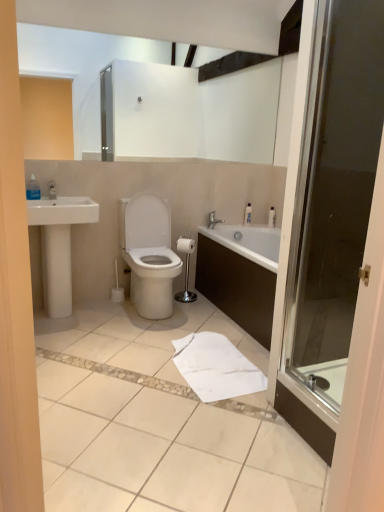
Question: Is transparent plastic bottle at upper left, marked as the 1th toiletry in a left-to-right arrangement, facing away from silver metallic faucet at upper center?

Choices:
 (A) yes
 (B) no

Answer: (B)

Question: From a real-world perspective, does transparent plastic bottle at upper left, marked as the 1th toiletry in a left-to-right arrangement, sit lower than silver metallic faucet at upper center?

Choices:
 (A) yes
 (B) no

Answer: (B)

Question: Does transparent plastic bottle at upper left, the third toiletry viewed from the right, come behind silver metallic faucet at upper center?

Choices:
 (A) no
 (B) yes

Answer: (A)

Question: From the image's perspective, is transparent plastic bottle at upper left, the first toiletry viewed from the front, on silver metallic faucet at upper center?

Choices:
 (A) no
 (B) yes

Answer: (B)

Question: Is transparent plastic bottle at upper left, the first toiletry viewed from the front, to the left of silver metallic faucet at upper center from the viewer's perspective?

Choices:
 (A) yes
 (B) no

Answer: (A)

Question: Is transparent plastic bottle at upper left, which appears as the 3th toiletry when viewed from the back, taller than silver metallic faucet at upper center?

Choices:
 (A) no
 (B) yes

Answer: (B)

Question: Can you confirm if white ceramic sink at left is taller than white plastic bottle at upper right, acting as the 1th toiletry starting from the right?

Choices:
 (A) yes
 (B) no

Answer: (A)

Question: Is white ceramic sink at left oriented away from white plastic bottle at upper right, positioned as the 3th toiletry in left-to-right order?

Choices:
 (A) no
 (B) yes

Answer: (A)

Question: Is white ceramic sink at left aimed at white plastic bottle at upper right, placed as the 1th toiletry when sorted from back to front?

Choices:
 (A) yes
 (B) no

Answer: (B)

Question: From the image's perspective, is white ceramic sink at left on white plastic bottle at upper right, placed as the 1th toiletry when sorted from back to front?

Choices:
 (A) yes
 (B) no

Answer: (B)

Question: From the image's perspective, is white ceramic sink at left located beneath white plastic bottle at upper right, positioned as the 3th toiletry in left-to-right order?

Choices:
 (A) no
 (B) yes

Answer: (B)

Question: Is white ceramic sink at left outside of white plastic bottle at upper right, placed as the 1th toiletry when sorted from back to front?

Choices:
 (A) yes
 (B) no

Answer: (A)

Question: Could you tell me if white paper towel at lower center is turned towards transparent plastic bottle at upper left, the third toiletry viewed from the right?

Choices:
 (A) yes
 (B) no

Answer: (B)